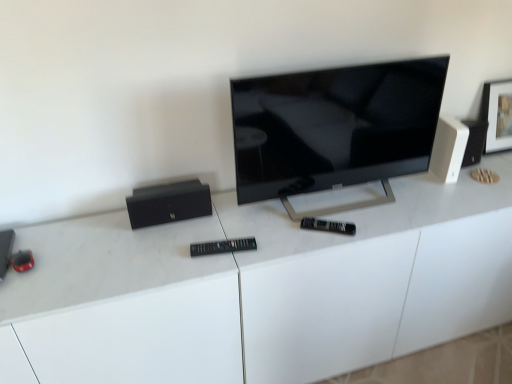
Find the location of `unoccupied region to the right of black glossy tv at center`. unoccupied region to the right of black glossy tv at center is located at coordinates (432, 205).